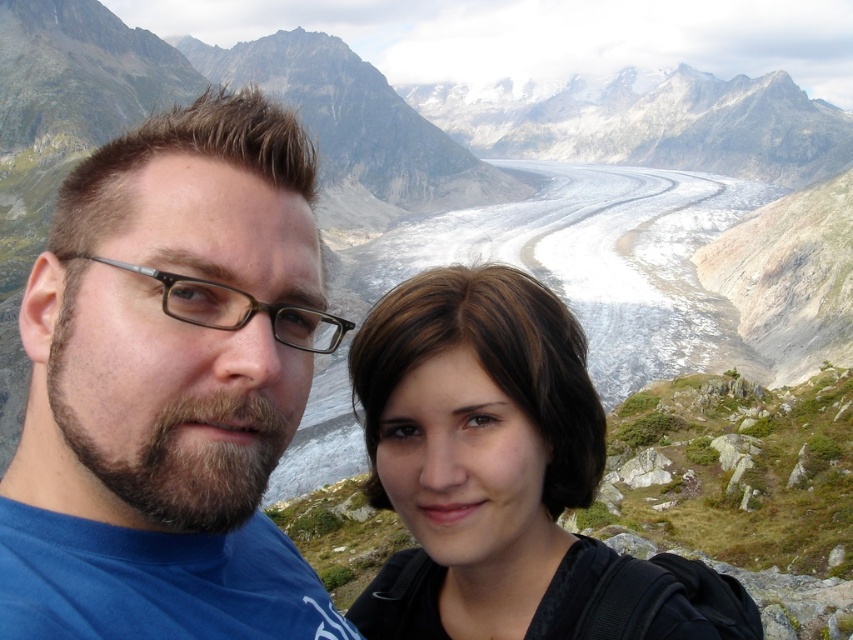
Question: Which point is farther from the camera taking this photo?

Choices:
 (A) (177, 138)
 (B) (465, 406)
 (C) (339, 339)

Answer: (B)

Question: Can you confirm if brown hair at center is positioned to the right of browntransparentglasses at left?

Choices:
 (A) yes
 (B) no

Answer: (A)

Question: Which is farther from the browntransparentglasses at left?

Choices:
 (A) brown hair at center
 (B) bearded man with glasses at left

Answer: (A)

Question: Which object is farther from the camera taking this photo?

Choices:
 (A) bearded man with glasses at left
 (B) brown hair at center
 (C) browntransparentglasses at left

Answer: (B)

Question: Does brown hair at center appear on the right side of browntransparentglasses at left?

Choices:
 (A) yes
 (B) no

Answer: (A)

Question: Can you confirm if brown hair at center is positioned above browntransparentglasses at left?

Choices:
 (A) no
 (B) yes

Answer: (A)